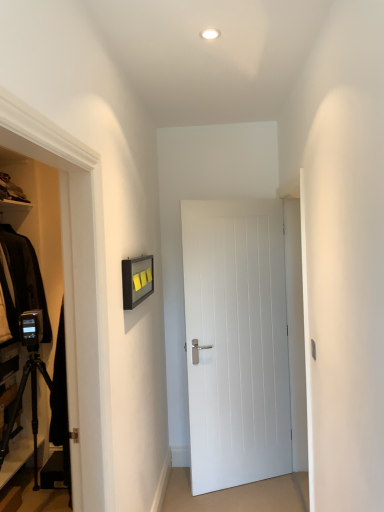
Identify the location of blank area beneath white smooth door at center (from a real-world perspective). The width and height of the screenshot is (384, 512). (246, 481).